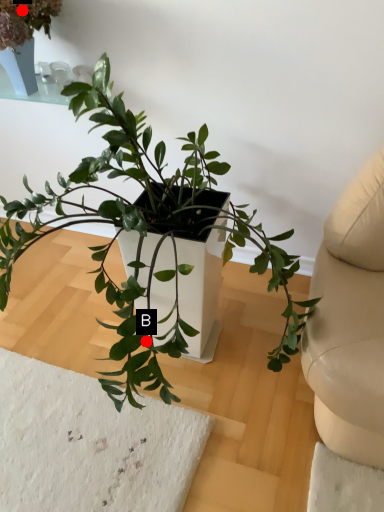
Question: Two points are circled on the image, labeled by A and B beside each circle. Which point is further to the camera?

Choices:
 (A) A is further
 (B) B is further

Answer: (A)